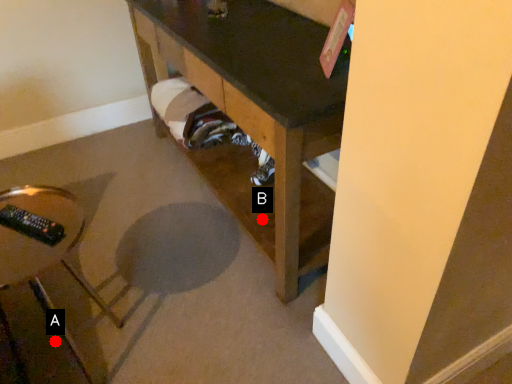
Question: Two points are circled on the image, labeled by A and B beside each circle. Which of the following is the closest to the observer?

Choices:
 (A) A is closer
 (B) B is closer

Answer: (A)